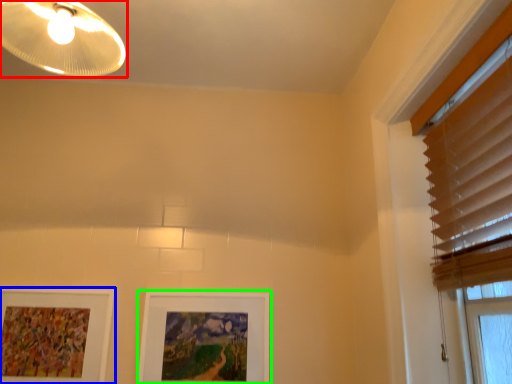
Question: Which object is the closest to the lamp (highlighted by a red box)? Choose among these: picture frame (highlighted by a blue box) or picture frame (highlighted by a green box).

Choices:
 (A) picture frame
 (B) picture frame

Answer: (A)